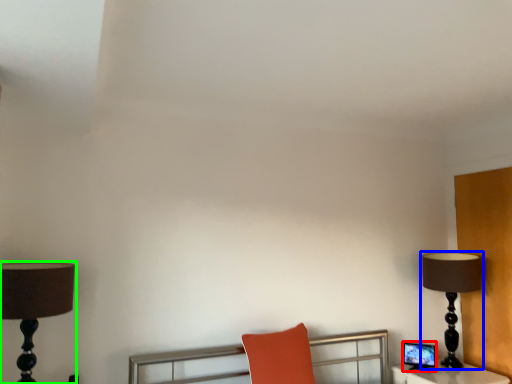
Question: Which object is positioned closest to computer monitor (highlighted by a red box)? Select from lamp (highlighted by a blue box) and lamp (highlighted by a green box).

Choices:
 (A) lamp
 (B) lamp

Answer: (A)